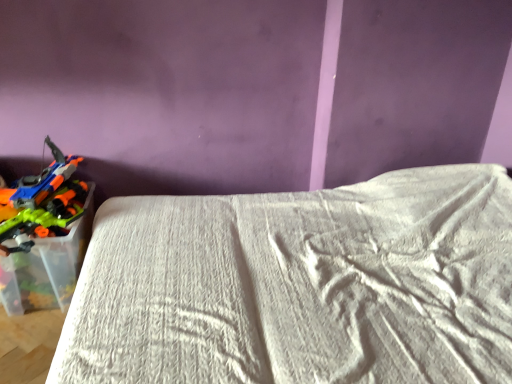
Question: From the image's perspective, is translucent plastic toy guns at left located above white textured bed at lower left?

Choices:
 (A) yes
 (B) no

Answer: (A)

Question: From a real-world perspective, does translucent plastic toy guns at left stand above white textured bed at lower left?

Choices:
 (A) yes
 (B) no

Answer: (A)

Question: Does translucent plastic toy guns at left appear on the right side of white textured bed at lower left?

Choices:
 (A) no
 (B) yes

Answer: (A)

Question: Does translucent plastic toy guns at left turn towards white textured bed at lower left?

Choices:
 (A) no
 (B) yes

Answer: (A)

Question: Considering the relative sizes of translucent plastic toy guns at left and white textured bed at lower left in the image provided, is translucent plastic toy guns at left thinner than white textured bed at lower left?

Choices:
 (A) no
 (B) yes

Answer: (B)

Question: Does translucent plastic toy guns at left have a greater height compared to white textured bed at lower left?

Choices:
 (A) no
 (B) yes

Answer: (A)

Question: Considering the relative positions of white textured bed at lower left and translucent plastic toy guns at left in the image provided, is white textured bed at lower left to the right of translucent plastic toy guns at left from the viewer's perspective?

Choices:
 (A) yes
 (B) no

Answer: (A)

Question: Does white textured bed at lower left have a greater width compared to translucent plastic toy guns at left?

Choices:
 (A) yes
 (B) no

Answer: (A)

Question: Is white textured bed at lower left positioned behind translucent plastic toy guns at left?

Choices:
 (A) no
 (B) yes

Answer: (A)

Question: Could you tell me if white textured bed at lower left is facing translucent plastic toy guns at left?

Choices:
 (A) yes
 (B) no

Answer: (A)

Question: Is white textured bed at lower left bigger than translucent plastic toy guns at left?

Choices:
 (A) yes
 (B) no

Answer: (A)

Question: Does white textured bed at lower left have a lesser height compared to translucent plastic toy guns at left?

Choices:
 (A) yes
 (B) no

Answer: (B)

Question: Is translucent plastic toy guns at left in front of or behind white textured bed at lower left in the image?

Choices:
 (A) behind
 (B) front

Answer: (A)